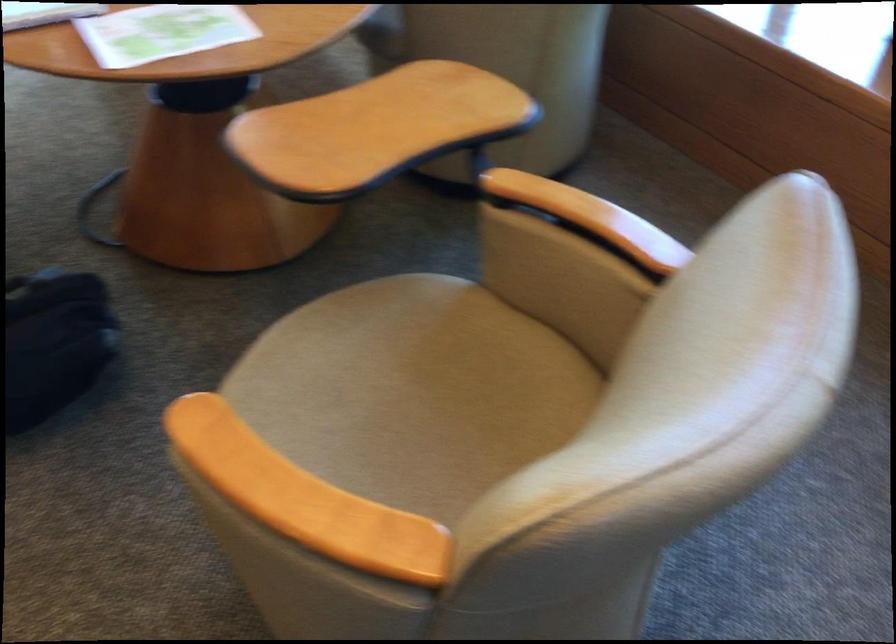
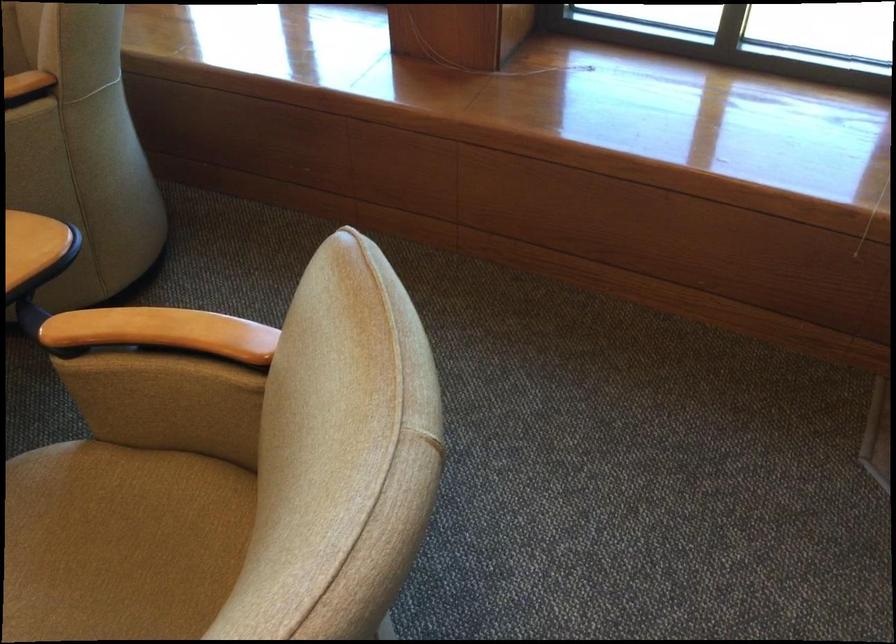
Where in the second image is the point corresponding to point 469,368 from the first image?

(121, 542)